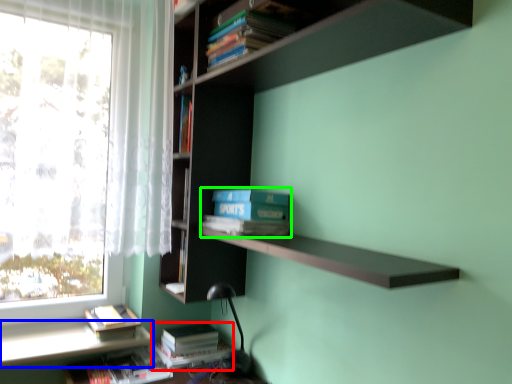
Question: Which is nearer to the book (highlighted by a red box)? window sill (highlighted by a blue box) or paperback book (highlighted by a green box).

Choices:
 (A) window sill
 (B) paperback book

Answer: (A)